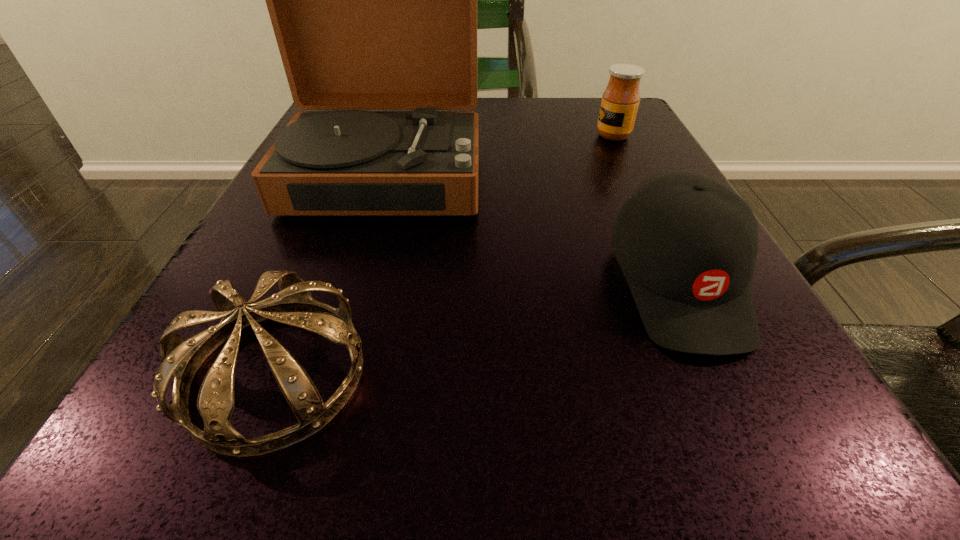
This screenshot has height=540, width=960. In order to click on unoccupied position between the tiara and the baseball cap in this screenshot , I will do `click(477, 328)`.

The height and width of the screenshot is (540, 960). I want to click on free area in between the phonograph record and the tiara, so click(331, 274).

Where is `vacant point located between the tiara and the baseball cap`? Image resolution: width=960 pixels, height=540 pixels. vacant point located between the tiara and the baseball cap is located at coordinates (477, 328).

Identify which object is the third closest to the tiara. Please provide its 2D coordinates. Your answer should be formatted as a tuple, i.e. [(x, y)], where the tuple contains the x and y coordinates of a point satisfying the conditions above.

[(620, 100)]

Point out which object is positioned as the nearest to the baseball cap. Please provide its 2D coordinates. Your answer should be formatted as a tuple, i.e. [(x, y)], where the tuple contains the x and y coordinates of a point satisfying the conditions above.

[(373, 0)]

The image size is (960, 540). In order to click on free space in the image that satisfies the following two spatial constraints: 1. on the front-facing side of the honey; 2. with a logo on the front of the baseball cap in this screenshot , I will do `click(685, 283)`.

Find the location of `vacant space that satisfies the following two spatial constraints: 1. on the front-facing side of the honey; 2. on the face of the phonograph record`. vacant space that satisfies the following two spatial constraints: 1. on the front-facing side of the honey; 2. on the face of the phonograph record is located at coordinates (632, 173).

Where is `free space that satisfies the following two spatial constraints: 1. on the front-facing side of the honey; 2. on the front side of the tiara`? free space that satisfies the following two spatial constraints: 1. on the front-facing side of the honey; 2. on the front side of the tiara is located at coordinates pyautogui.click(x=730, y=374).

Locate an element on the screen. The width and height of the screenshot is (960, 540). free space that satisfies the following two spatial constraints: 1. on the front-facing side of the honey; 2. on the face of the phonograph record is located at coordinates (632, 173).

Where is `free space that satisfies the following two spatial constraints: 1. on the front-facing side of the honey; 2. with a logo on the front of the baseball cap`? free space that satisfies the following two spatial constraints: 1. on the front-facing side of the honey; 2. with a logo on the front of the baseball cap is located at coordinates (685, 283).